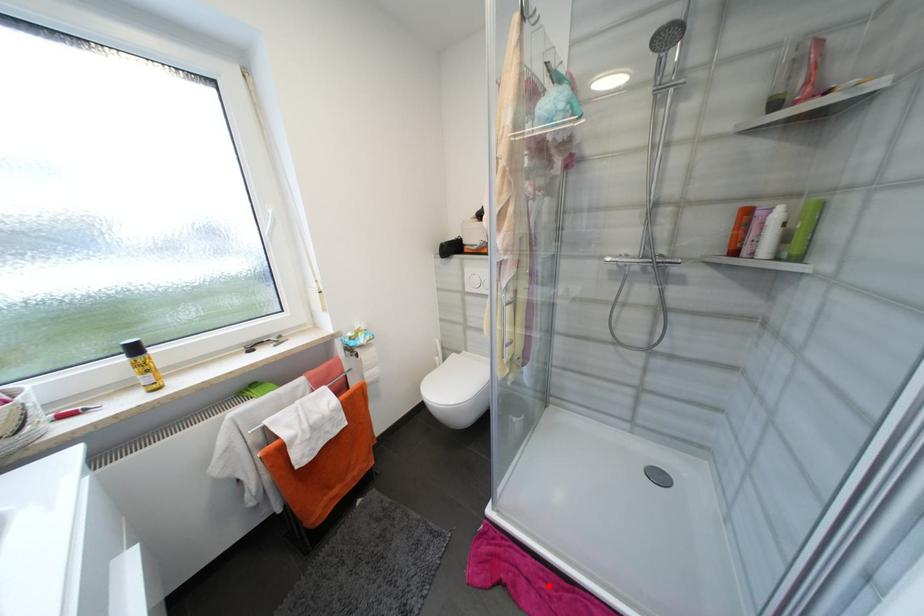
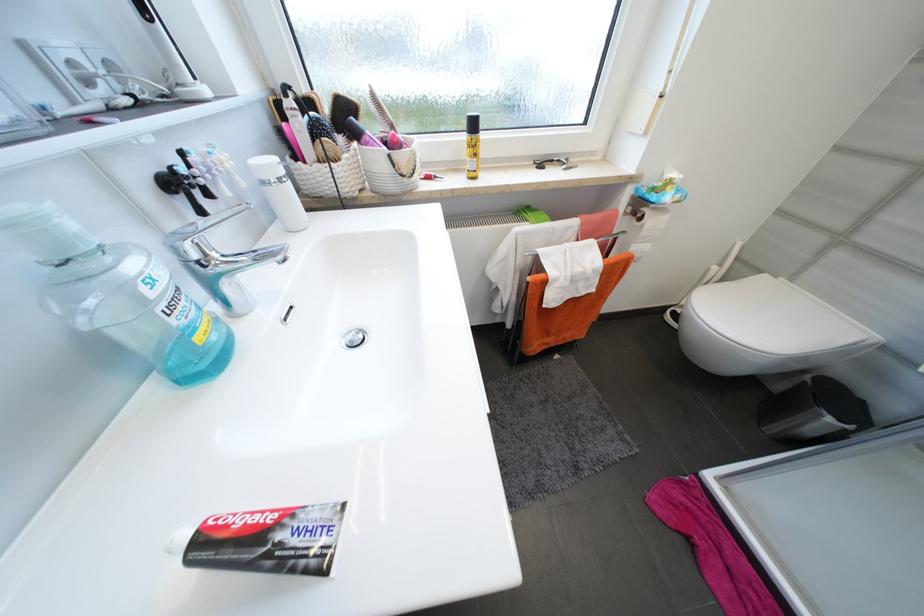
The point at the highlighted location is marked in the first image. Where is the corresponding point in the second image?

(759, 596)